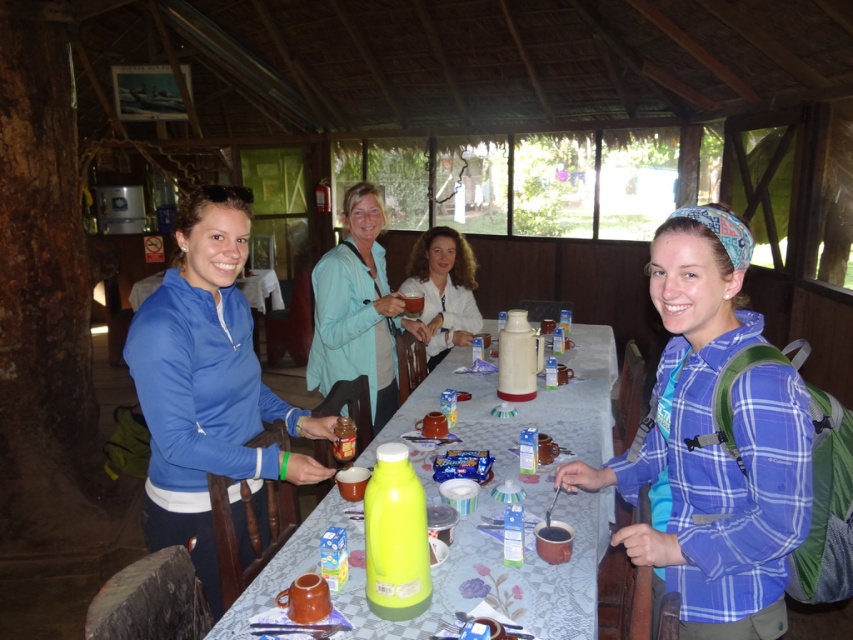
You are a photographer standing at the edge of the table. You want to take a photo that includes both the matte blue sweatshirt at left and the white matte shirt at center. What is the minimum distance you need to move backward to ensure both are in frame?

The matte blue sweatshirt at left is 1.74 meters from the white matte shirt at center. To include both in the frame, you need to move backward at least 1.74 meters so that the camera can capture the entire distance between them.

You are a photographer positioned to the right of the scene. You want to take a photo that includes both the matte blue sweatshirt at left and the light blue fabric shirt at center. Which one should you focus on first to ensure both are in frame?

You should focus on the matte blue sweatshirt at left first since it is positioned to the left of the light blue fabric shirt at center, so by starting there, you can ensure both are included in the frame from left to right.

You are standing at the entrance of the rustic hut and want to reach the two points marked on the table. Which point, point (x=193, y=524) or point (x=376, y=196), is closer to you?

Point (x=193, y=524) is in front of point (x=376, y=196), so it is closer to you.